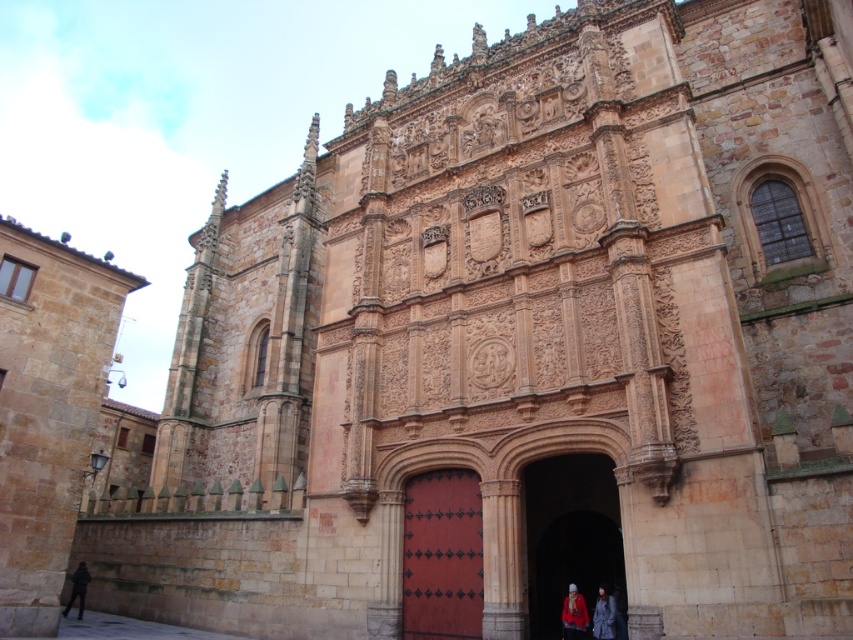
Question: Can you confirm if smooth stone archway at center is smaller than dark blue fabric coat at lower center?

Choices:
 (A) yes
 (B) no

Answer: (B)

Question: Is red wool coat at center positioned at the back of dark gray jacket at lower left?

Choices:
 (A) no
 (B) yes

Answer: (A)

Question: Considering the relative positions of smooth stone archway at center and smooth red wood door at center in the image provided, where is smooth stone archway at center located with respect to smooth red wood door at center?

Choices:
 (A) above
 (B) below

Answer: (A)

Question: Which point appears closest to the camera in this image?

Choices:
 (A) (469, 493)
 (B) (532, 576)
 (C) (573, 627)
 (D) (614, 604)

Answer: (C)

Question: Estimate the real-world distances between objects in this image. Which object is closer to the dark gray jacket at lower left?

Choices:
 (A) dark blue fabric coat at lower center
 (B) smooth stone archway at center
 (C) smooth red wood door at center
 (D) red woolen hat at lower center

Answer: (C)

Question: Which object is closer to the camera taking this photo?

Choices:
 (A) red wool coat at center
 (B) red woolen hat at lower center

Answer: (A)